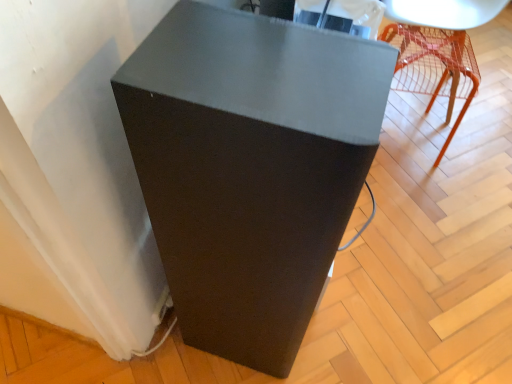
Question: Is matte black speaker at lower left, which is the 2th furniture in top-to-bottom order, beside translucent orange chair at upper right, the 2th furniture in the bottom-to-top sequence?

Choices:
 (A) yes
 (B) no

Answer: (B)

Question: Can translucent orange chair at upper right, the second furniture positioned from the left, be found inside matte black speaker at lower left, which is the 2th furniture in top-to-bottom order?

Choices:
 (A) no
 (B) yes

Answer: (A)

Question: Is matte black speaker at lower left, marked as the 2th furniture in a right-to-left arrangement, wider than translucent orange chair at upper right, which ranks as the 1th furniture in right-to-left order?

Choices:
 (A) yes
 (B) no

Answer: (A)

Question: From the image's perspective, is matte black speaker at lower left, which is the second furniture from back to front, located above translucent orange chair at upper right, which ranks as the 1th furniture in right-to-left order?

Choices:
 (A) no
 (B) yes

Answer: (A)

Question: Is matte black speaker at lower left, the 1th furniture when ordered from bottom to top, outside translucent orange chair at upper right, which ranks as the 1th furniture in right-to-left order?

Choices:
 (A) no
 (B) yes

Answer: (B)

Question: From a real-world perspective, is matte black speaker at lower left, which is the second furniture from back to front, on translucent orange chair at upper right, which appears as the first furniture when viewed from the back?

Choices:
 (A) yes
 (B) no

Answer: (A)

Question: Is matte black speaker at lower left, which is the second furniture from back to front, at the back of translucent orange chair at upper right, the second furniture in the front-to-back sequence?

Choices:
 (A) yes
 (B) no

Answer: (B)

Question: From the image's perspective, is translucent orange chair at upper right, the second furniture in the front-to-back sequence, beneath matte black speaker at lower left, which appears as the 1th furniture when viewed from the left?

Choices:
 (A) no
 (B) yes

Answer: (A)

Question: From a real-world perspective, is translucent orange chair at upper right, which appears as the first furniture when viewed from the back, on top of matte black speaker at lower left, which is the 1th furniture in front-to-back order?

Choices:
 (A) no
 (B) yes

Answer: (A)

Question: Is translucent orange chair at upper right, the 2th furniture in the bottom-to-top sequence, in front of matte black speaker at lower left, the 1th furniture when ordered from bottom to top?

Choices:
 (A) no
 (B) yes

Answer: (A)

Question: Considering the relative sizes of translucent orange chair at upper right, which ranks as the 1th furniture in right-to-left order, and matte black speaker at lower left, which is the 2th furniture in top-to-bottom order, in the image provided, is translucent orange chair at upper right, which ranks as the 1th furniture in right-to-left order, bigger than matte black speaker at lower left, which is the 2th furniture in top-to-bottom order,?

Choices:
 (A) no
 (B) yes

Answer: (A)

Question: Is translucent orange chair at upper right, the 2th furniture in the bottom-to-top sequence, with matte black speaker at lower left, the 1th furniture when ordered from bottom to top?

Choices:
 (A) no
 (B) yes

Answer: (A)

Question: Does point (362, 79) appear closer or farther from the camera than point (455, 46)?

Choices:
 (A) closer
 (B) farther

Answer: (A)